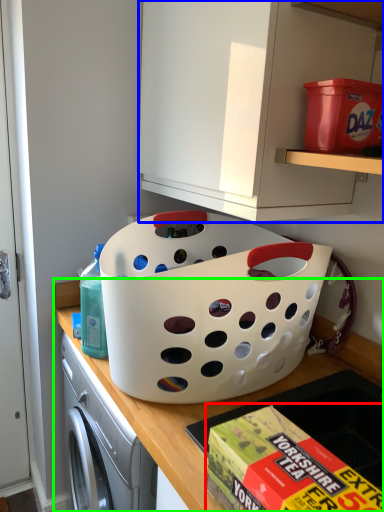
Question: Based on their relative distances, which object is farther from box (highlighted by a red box)? Choose from cabinetry (highlighted by a blue box) and countertop (highlighted by a green box).

Choices:
 (A) cabinetry
 (B) countertop

Answer: (A)